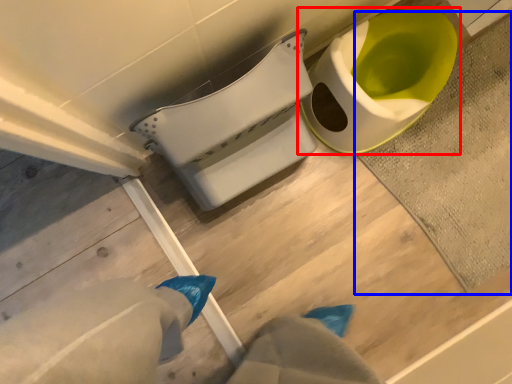
Question: Which object appears farthest to the camera in this image, toilet (highlighted by a red box) or bath mat (highlighted by a blue box)?

Choices:
 (A) toilet
 (B) bath mat

Answer: (B)